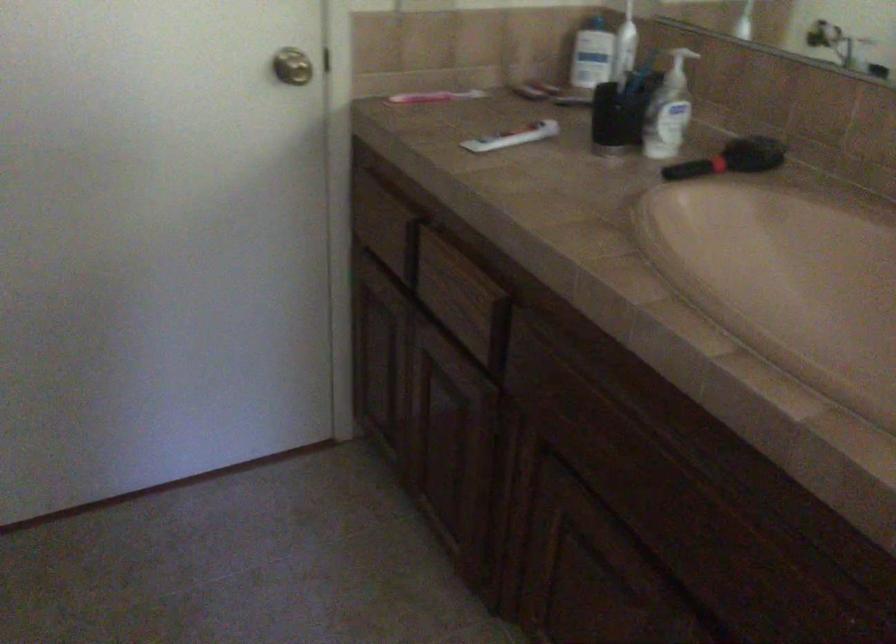
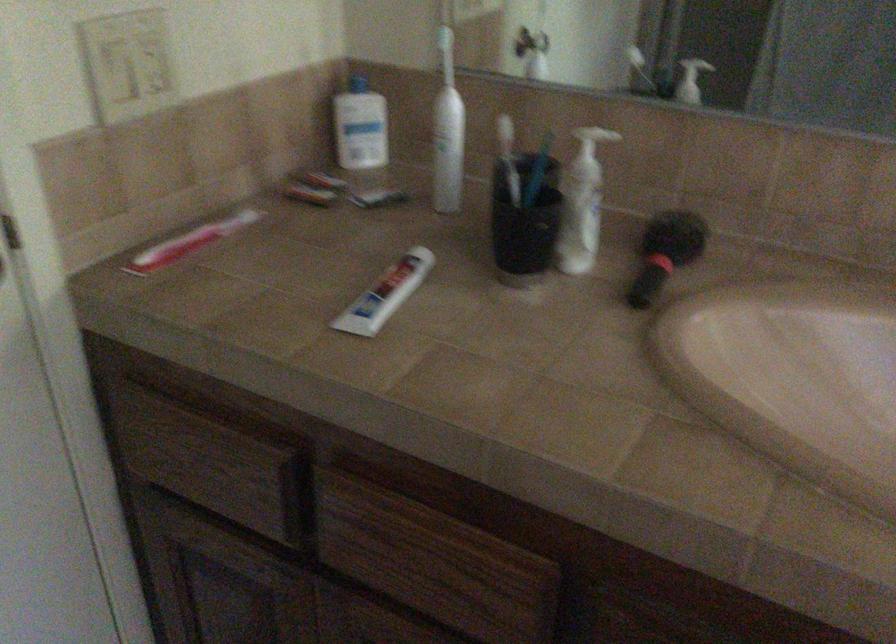
Locate, in the second image, the point that corresponds to point (426, 95) in the first image.

(188, 242)